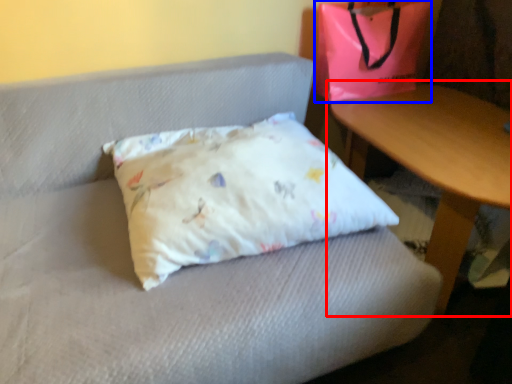
Question: Which point is closer to the camera, table (highlighted by a red box) or pouch (highlighted by a blue box)?

Choices:
 (A) table
 (B) pouch

Answer: (A)